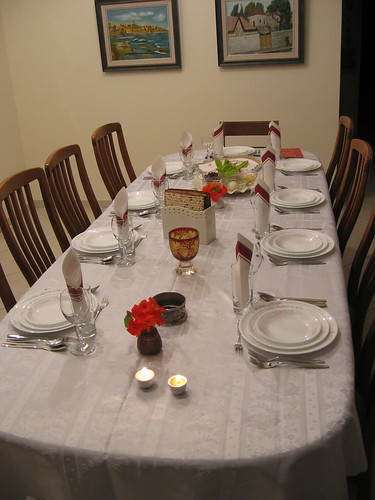
Where is `napkins`? napkins is located at coordinates (75, 267), (122, 203), (159, 166), (187, 137), (221, 128), (274, 127), (269, 154), (262, 191), (242, 245).